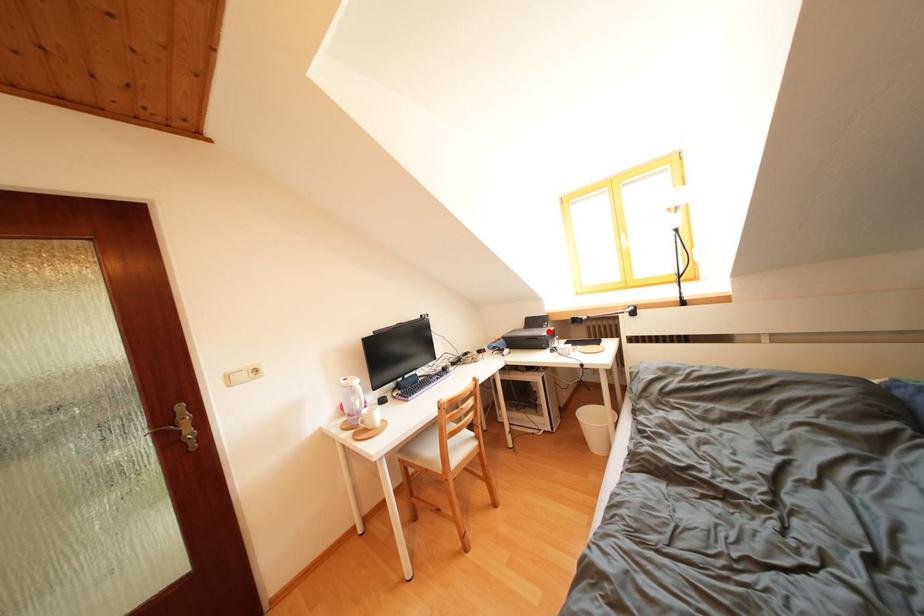
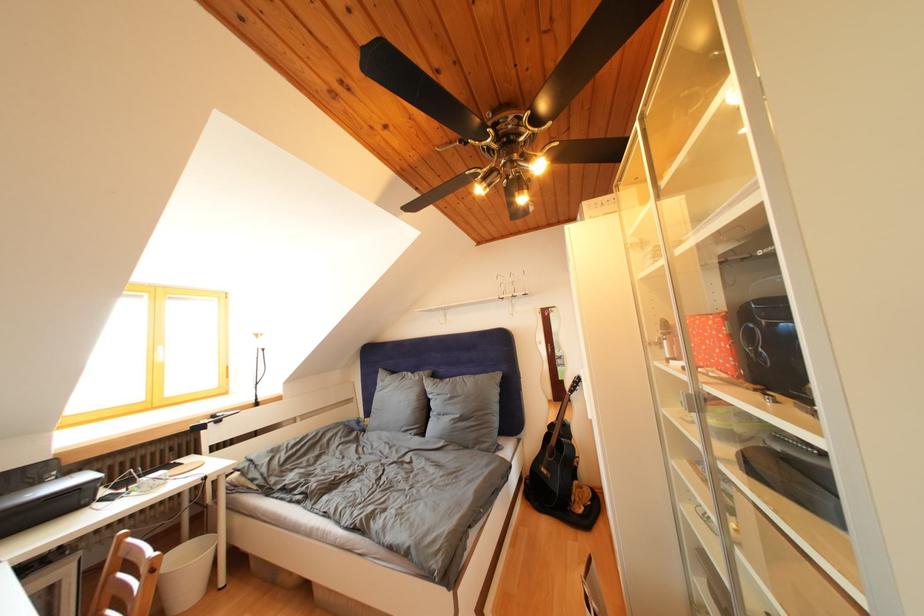
Question: I am providing you with two images of the same scene from different viewpoints. Given a red point in image1, look at the same physical point in image2. Is it:

Choices:
 (A) Closer to the viewpoint
 (B) Farther from the viewpoint

Answer: (A)